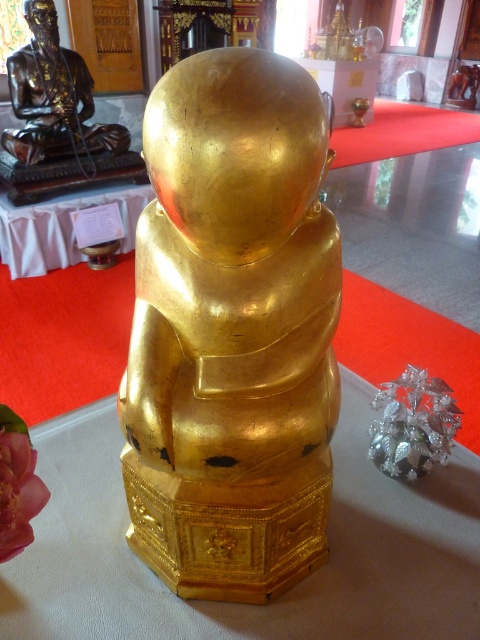
You are standing in front of the golden statue of a seated figure and want to place a small offering at a specific point marked at coordinates point (299,577). If your arm reaches 1.5 meters, can you comfortably reach that point without moving your position?

The distance of point (299,577) from viewer is 1.44 meters, so yes, you can comfortably reach it with your arm since it is within your reach of 1.5 meters.

You are an art curator planning to display both the gold polished statue at center and the bronze statue at upper left in a new exhibition. Based on their sizes, which statue should be placed on a higher platform to ensure both are visible to visitors?

The gold polished statue at center is taller than the bronze statue at upper left. To ensure both are visible, the bronze statue at upper left should be placed on a higher platform so that its height combined with the platform matches the visibility of the taller gold polished statue at center.

You are standing in front of the golden statue of a seated figure. There is a point marked at coordinates [232,330]. Which object does this point indicate?

The point at coordinates [232,330] marks the gold polished statue at center.